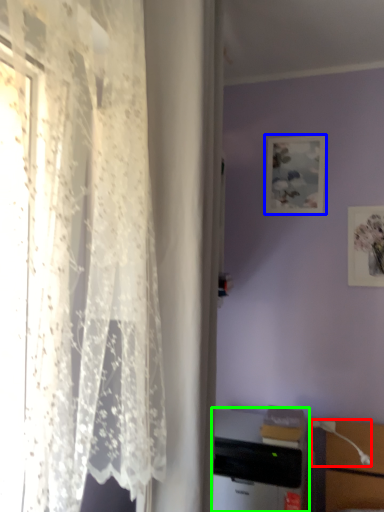
Question: Based on their relative distances, which object is nearer to table lamp (highlighted by a red box)? Choose from picture frame (highlighted by a blue box) and desktop computer (highlighted by a green box).

Choices:
 (A) picture frame
 (B) desktop computer

Answer: (B)